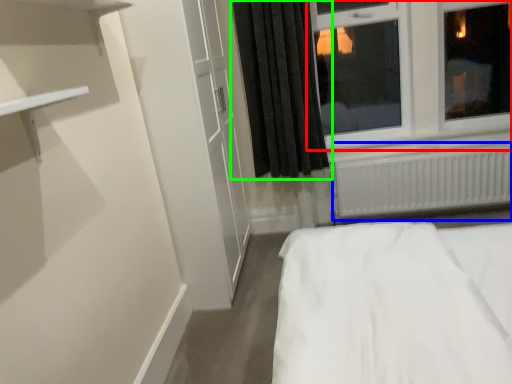
Question: Which object is the farthest from window (highlighted by a red box)? Choose among these: radiator (highlighted by a blue box) or curtain (highlighted by a green box).

Choices:
 (A) radiator
 (B) curtain

Answer: (B)